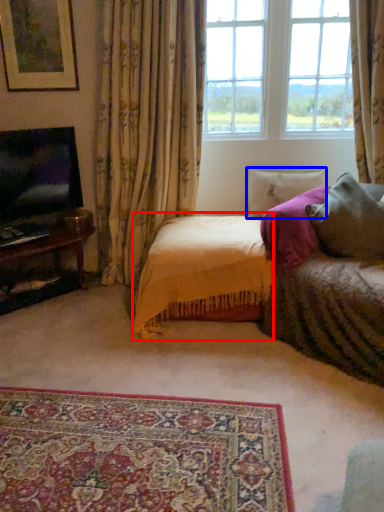
Question: Which point is closer to the camera, bedding (highlighted by a red box) or pillow (highlighted by a blue box)?

Choices:
 (A) bedding
 (B) pillow

Answer: (A)